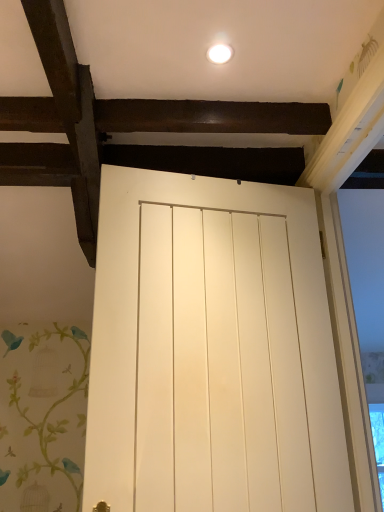
This screenshot has width=384, height=512. What do you see at coordinates (212, 350) in the screenshot?
I see `white matte door at center` at bounding box center [212, 350].

Based on the photo, what is the approximate width of white matte door at center?

white matte door at center is 6.78 inches in width.

You are a GUI agent. You are given a task and a screenshot of the screen. Output one action in this format:
    pyautogui.click(x=<x>, y=<y>)
    Task: Click on the white matte door at center
    
    Given the screenshot: What is the action you would take?
    pyautogui.click(x=212, y=350)

Measure the distance between point (214, 49) and camera.

Point (214, 49) and camera are 1.17 meters apart from each other.

Identify the location of white glossy light fixture at upper center. The height and width of the screenshot is (512, 384). (220, 53).

The height and width of the screenshot is (512, 384). What do you see at coordinates (220, 53) in the screenshot?
I see `white glossy light fixture at upper center` at bounding box center [220, 53].

I want to click on white matte door at center, so click(212, 350).

Can you confirm if white matte door at center is positioned to the right of white glossy light fixture at upper center?

Yes.

Consider the image. Is white matte door at center in front of or behind white glossy light fixture at upper center in the image?

white matte door at center is in front of white glossy light fixture at upper center.

Considering the points (139, 441) and (219, 58), which point is behind, point (139, 441) or point (219, 58)?

Point (219, 58)

From the image's perspective, which is below, white matte door at center or white glossy light fixture at upper center?

white matte door at center, from the image's perspective.

From a real-world perspective, is white matte door at center on white glossy light fixture at upper center?

No, from a real-world perspective, white matte door at center is not over white glossy light fixture at upper center

Is white matte door at center wider than white glossy light fixture at upper center?

Correct, the width of white matte door at center exceeds that of white glossy light fixture at upper center.

Between white matte door at center and white glossy light fixture at upper center, which one has more height?

white matte door at center is taller.

Can you confirm if white matte door at center is bigger than white glossy light fixture at upper center?

Yes.

Does white matte door at center contain white glossy light fixture at upper center?

No, white glossy light fixture at upper center is not surrounded by white matte door at center.

Is white matte door at center with white glossy light fixture at upper center?

There is a gap between white matte door at center and white glossy light fixture at upper center.

Is white matte door at center facing towards white glossy light fixture at upper center?

No, white matte door at center is not aimed at white glossy light fixture at upper center.

Find the location of a particular element. door below the white glossy light fixture at upper center (from a real-world perspective) is located at coordinates (212, 350).

Is white glossy light fixture at upper center at the right side of white matte door at center?

No.

Considering the relative positions of white glossy light fixture at upper center and white matte door at center in the image provided, is white glossy light fixture at upper center in front of white matte door at center?

That is False.

Considering the positions of points (216, 54) and (279, 195), is point (216, 54) farther from camera compared to point (279, 195)?

No.

From the image's perspective, is white glossy light fixture at upper center on top of white matte door at center?

Yes, from the image's perspective, white glossy light fixture at upper center is above white matte door at center.

From a real-world perspective, who is located lower, white glossy light fixture at upper center or white matte door at center?

From a 3D spatial view, white matte door at center is below.

Does white glossy light fixture at upper center have a lesser width compared to white matte door at center?

Yes.

Is white glossy light fixture at upper center shorter than white matte door at center?

Correct, white glossy light fixture at upper center is not as tall as white matte door at center.

Can you confirm if white glossy light fixture at upper center is smaller than white matte door at center?

Yes.

Is white glossy light fixture at upper center not within white matte door at center?

Absolutely, white glossy light fixture at upper center is external to white matte door at center.

Is there a large distance between white glossy light fixture at upper center and white matte door at center?

No, there isn't a large distance between white glossy light fixture at upper center and white matte door at center.

Is white glossy light fixture at upper center positioned with its back to white matte door at center?

No, white glossy light fixture at upper center is not facing the opposite direction of white matte door at center.

Where is `lighting behind the white matte door at center`? lighting behind the white matte door at center is located at coordinates (x=220, y=53).

Locate an element on the screen. The height and width of the screenshot is (512, 384). lighting that is above the white matte door at center (from the image's perspective) is located at coordinates (220, 53).

Locate an element on the screen. This screenshot has width=384, height=512. door below the white glossy light fixture at upper center (from the image's perspective) is located at coordinates (212, 350).